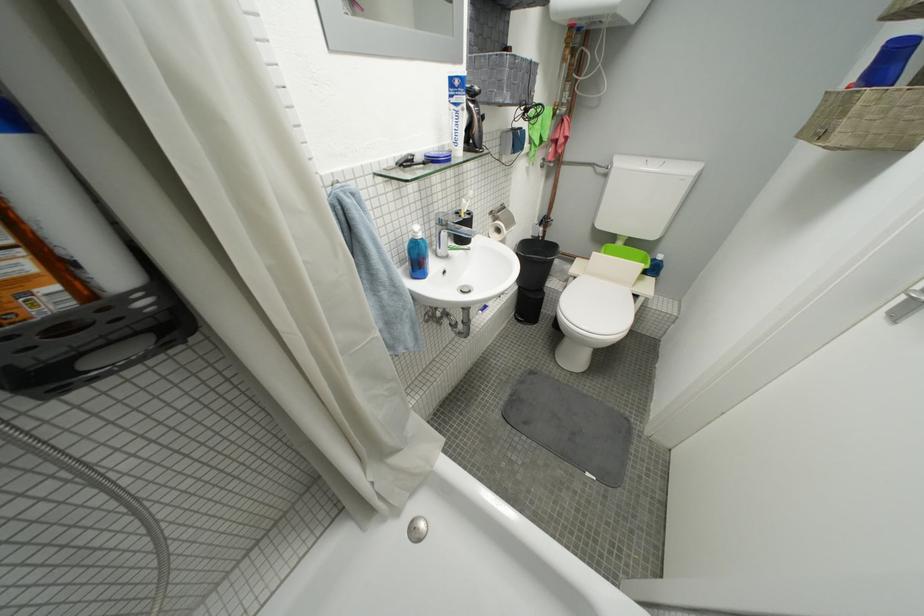
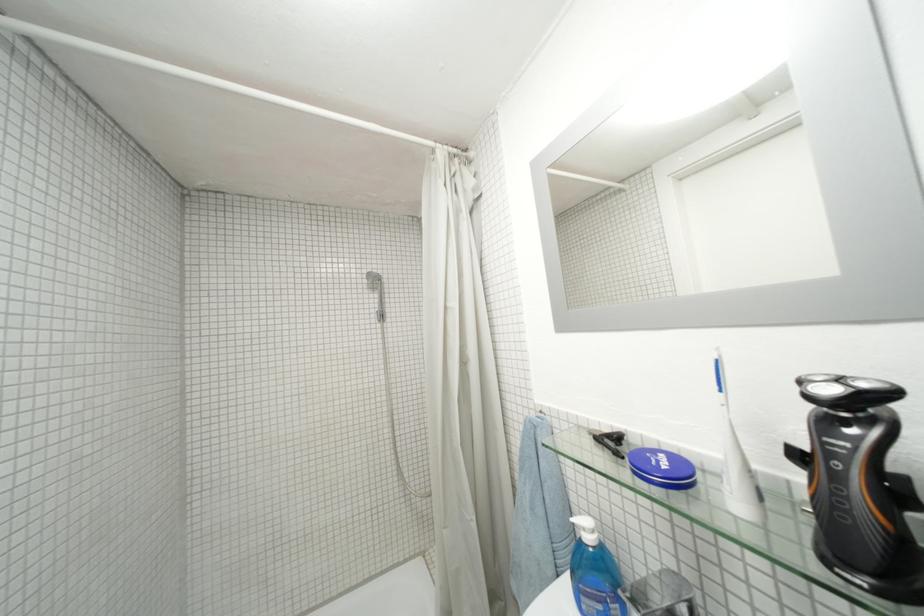
In the second image, find the point that corresponds to point (429, 238) in the first image.

(598, 541)